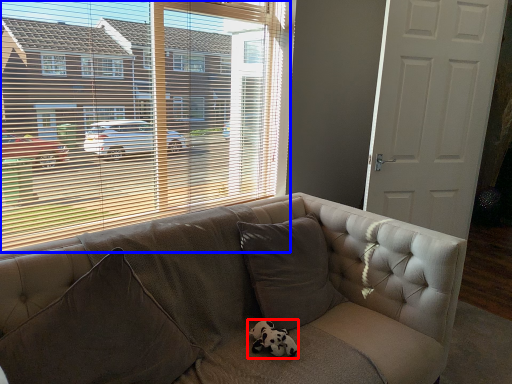
Question: Which object appears closest to the camera in this image, animal (highlighted by a red box) or window (highlighted by a blue box)?

Choices:
 (A) animal
 (B) window

Answer: (B)